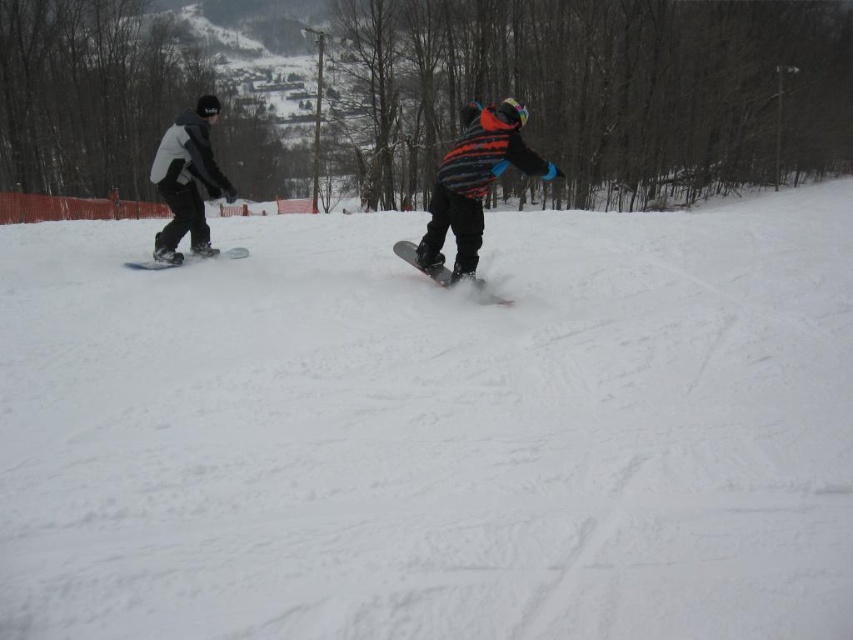
Looking at this image, you are a photographer trying to capture the snowboarders in the scene. You notice two objects labeled as matte black snowboarders at center and black matte snowboard at left. Which one would appear closer to the camera based on their size?

The matte black snowboarders at center appears larger in size than the black matte snowboard at left, so it would appear closer to the camera.

You are a photographer trying to capture both snowboards in a single shot. Given that the matte black snowboard at center and the black matte snowboard at left are in your viewfinder, which one would require you to zoom out more to fully capture it in the frame?

The black matte snowboard at left requires zooming out more because it occupies more space than the matte black snowboard at center.